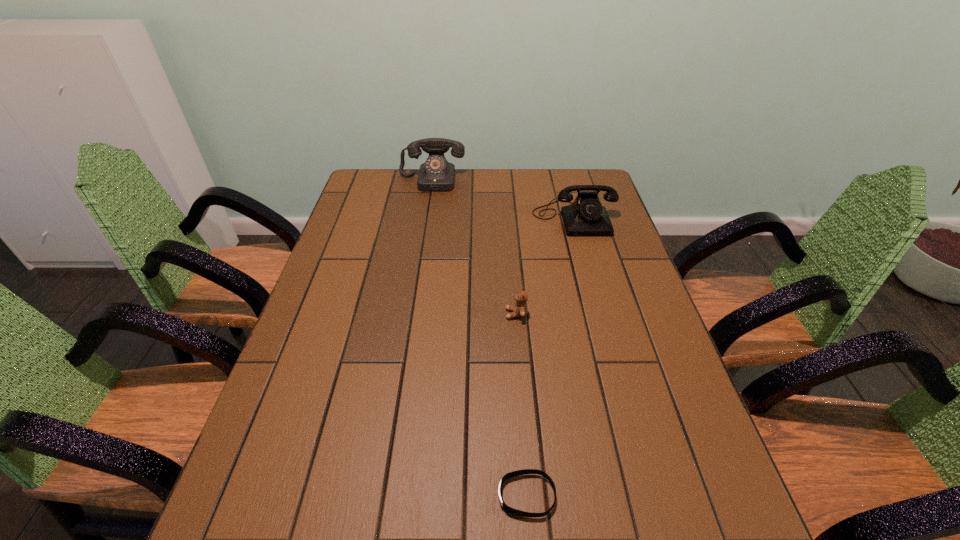
You are a GUI agent. You are given a task and a screenshot of the screen. Output one action in this format:
    pyautogui.click(x=<x>, y=<y>)
    Task: Click on the free spot between the second shortest object and the rightmost object
    Image resolution: width=960 pixels, height=540 pixels.
    Given the screenshot: What is the action you would take?
    pyautogui.click(x=545, y=266)

This screenshot has width=960, height=540. In order to click on free space between the wristband and the teddy bear in this screenshot , I will do `click(521, 405)`.

Find the location of a particular element. free space that is in between the shortest object and the third nearest object is located at coordinates (550, 357).

Locate an element on the screen. vacant space in between the second shortest object and the farthest object is located at coordinates (474, 247).

Locate an element on the screen. The height and width of the screenshot is (540, 960). object that is the second closest to the teddy bear is located at coordinates (525, 471).

This screenshot has height=540, width=960. In order to click on the third closest object relative to the third farthest object in this screenshot , I will do `click(436, 174)`.

I want to click on free space that satisfies the following two spatial constraints: 1. on the front face of the rightmost object; 2. on the front-facing side of the teddy bear, so (x=601, y=314).

Image resolution: width=960 pixels, height=540 pixels. I want to click on blank space that satisfies the following two spatial constraints: 1. on the front face of the second farthest object; 2. on the display of the shortest object, so click(x=651, y=495).

Where is `free space that satisfies the following two spatial constraints: 1. on the front face of the second farthest object; 2. on the display of the wristband`? free space that satisfies the following two spatial constraints: 1. on the front face of the second farthest object; 2. on the display of the wristband is located at coordinates (651, 495).

Image resolution: width=960 pixels, height=540 pixels. What are the coordinates of `free space that satisfies the following two spatial constraints: 1. on the front face of the right telephone; 2. on the front-facing side of the third tallest object` in the screenshot? It's located at (601, 314).